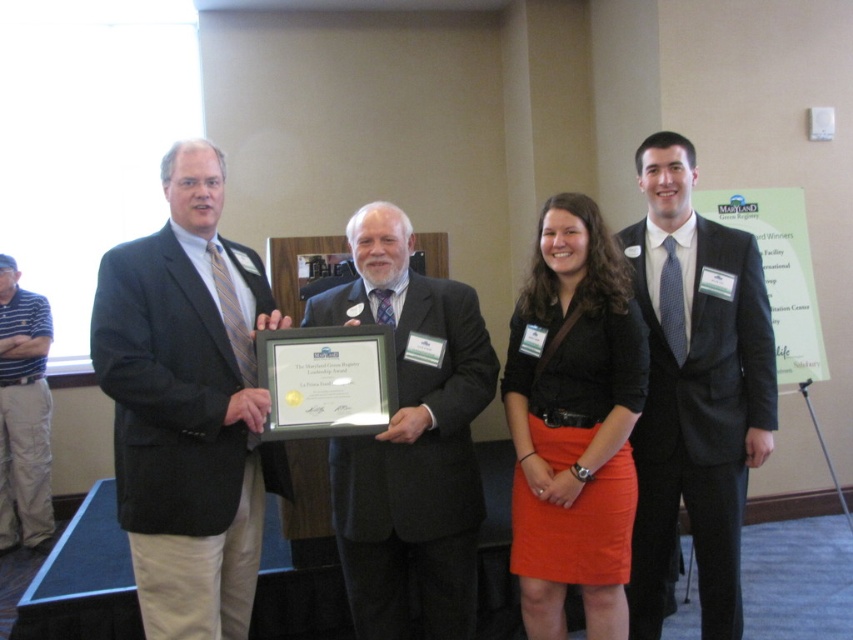
Question: Is matte black suit at center to the left of orange matte skirt at center from the viewer's perspective?

Choices:
 (A) yes
 (B) no

Answer: (A)

Question: Which point is farther from the camera taking this photo?

Choices:
 (A) (450, 344)
 (B) (149, 284)
 (C) (593, 499)
 (D) (35, 536)

Answer: (D)

Question: Which object appears farthest from the camera in this image?

Choices:
 (A) orange matte skirt at center
 (B) dark gray suit at left

Answer: (A)

Question: Which object is farther from the camera taking this photo?

Choices:
 (A) matte black suit at center
 (B) dark gray suit at right
 (C) dark gray suit at left
 (D) orange matte skirt at center

Answer: (B)

Question: Does dark gray suit at left have a larger size compared to orange matte skirt at center?

Choices:
 (A) yes
 (B) no

Answer: (A)

Question: Can you confirm if dark gray suit at left is thinner than striped cotton polo shirt at left?

Choices:
 (A) yes
 (B) no

Answer: (B)